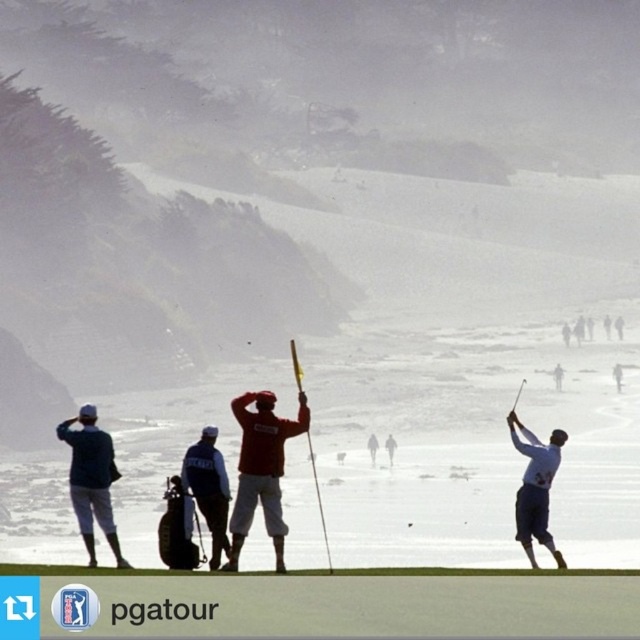
Question: Is denim pants at left above dark blue fabric jacket at center?

Choices:
 (A) yes
 (B) no

Answer: (A)

Question: Does red cotton shirt at center come in front of dark blue fabric jacket at center?

Choices:
 (A) no
 (B) yes

Answer: (B)

Question: Among these objects, which one is farthest from the camera?

Choices:
 (A) denim pants at left
 (B) dark blue fabric jacket at center

Answer: (B)

Question: Among these points, which one is nearest to the camera?

Choices:
 (A) pos(513,422)
 (B) pos(86,541)
 (C) pos(246,573)
 (D) pos(305,413)

Answer: (C)

Question: Which point is closer to the camera?

Choices:
 (A) dark blue fabric jacket at center
 (B) denim pants at left
 (C) white matte golf club at right

Answer: (B)

Question: Does red cotton shirt at center have a larger size compared to dark blue fabric jacket at center?

Choices:
 (A) yes
 (B) no

Answer: (A)